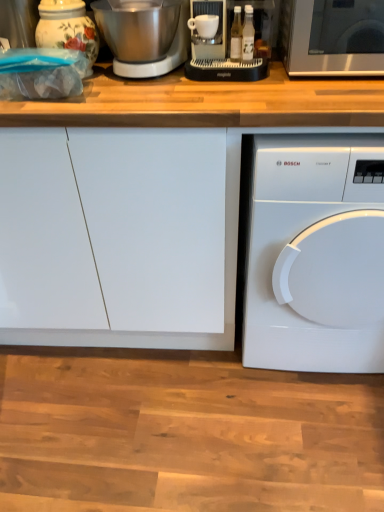
Where is `free location in front of brushed metal mixer at upper left`? This screenshot has width=384, height=512. free location in front of brushed metal mixer at upper left is located at coordinates (163, 98).